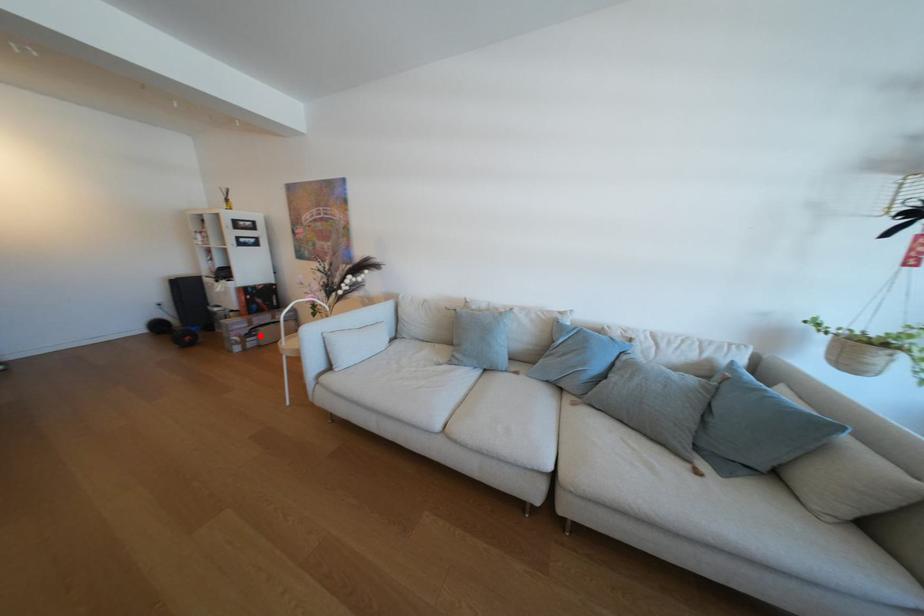
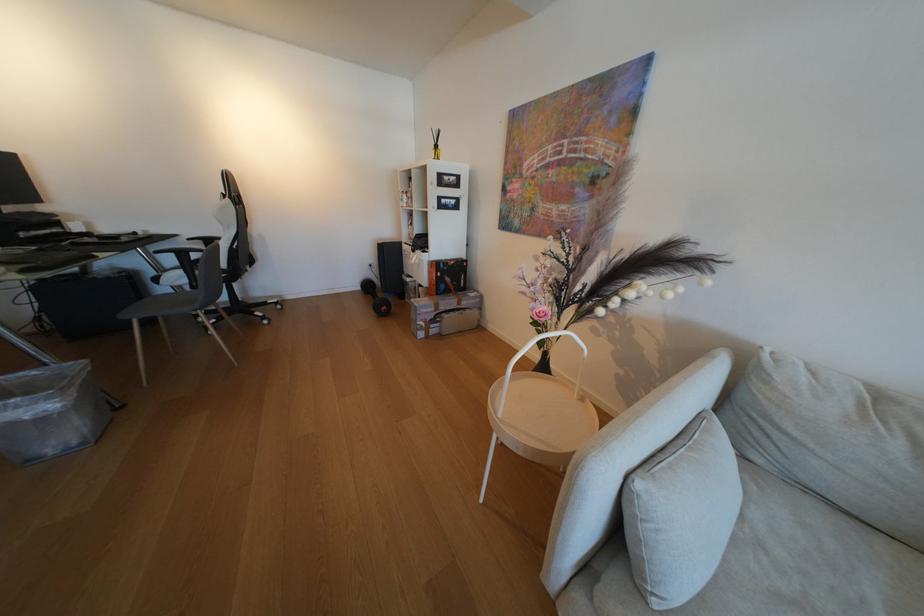
Question: I am providing you with two images of the same scene from different viewpoints. A red point is marked on the first image. Is the red point's position out of view in image 2?

Choices:
 (A) Yes
 (B) No

Answer: (B)